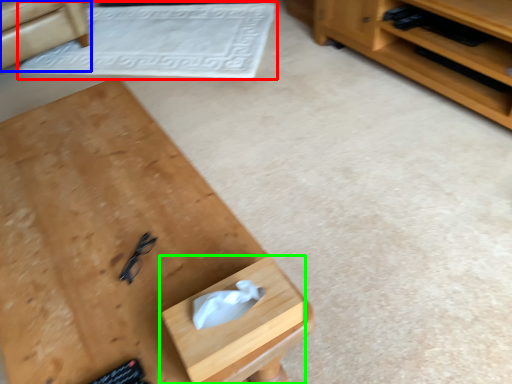
Question: Which is nearer to the mat (highlighted by a red box)? armchair (highlighted by a blue box) or drawer (highlighted by a green box).

Choices:
 (A) armchair
 (B) drawer

Answer: (A)